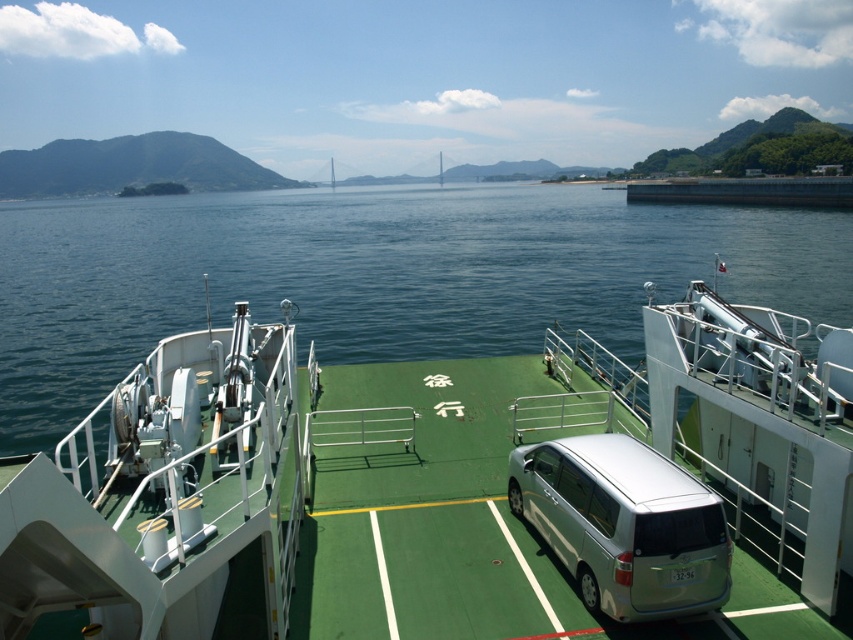
You are a passenger on the ferry and notice the green rubber boat at center and the green water at center. Which object is taller?

The green rubber boat at center is not as tall as the green water at center, so the green water at center is taller.

In the scene shown: You are a ferry attendant who needs to load a new vehicle onto the deck. The deck has a green rubber boat at center and a silver metallic van at center. Which object takes up more space on the deck?

The green rubber boat at center is bigger than the silver metallic van at center, so it takes up more space on the deck.

You are a delivery person on a ferry deck. You need to move a package from the green water at center to the silver metallic van at center. The package is 10 feet long. Is there enough space to move it without bending the package?

The distance between the green water at center and the silver metallic van at center is 106.34 feet. Since the package is only 10 feet long, there is ample space to move it without needing to bend the package.